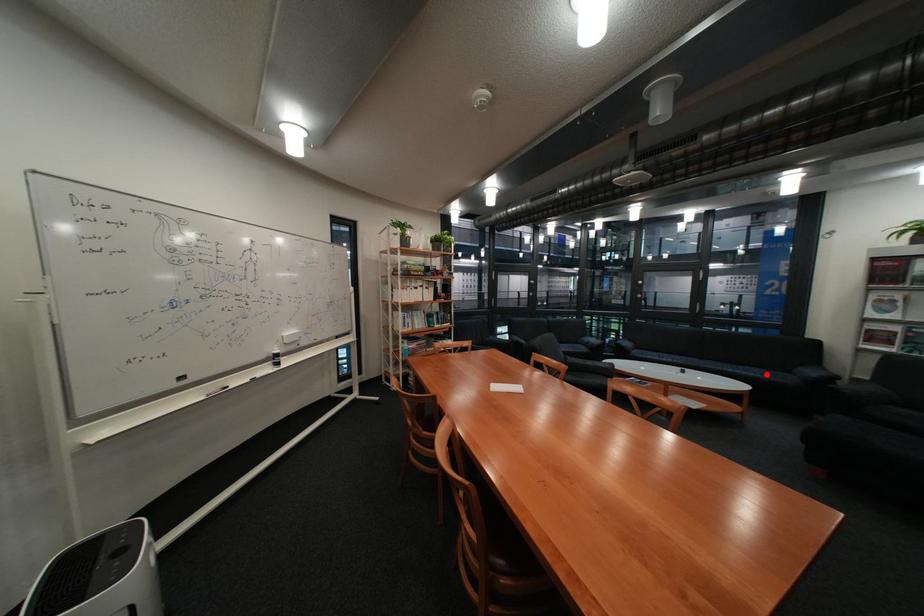
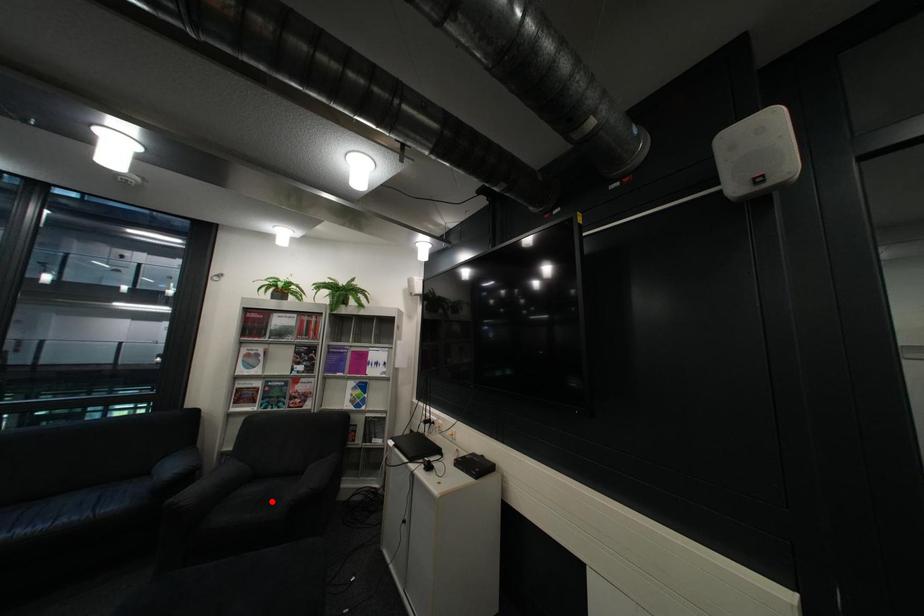
I am providing you with two images of the same scene from different viewpoints. A red point is marked on the first image and another point is marked on the second image. Is the red point in image1 aligned with the point shown in image2?

No